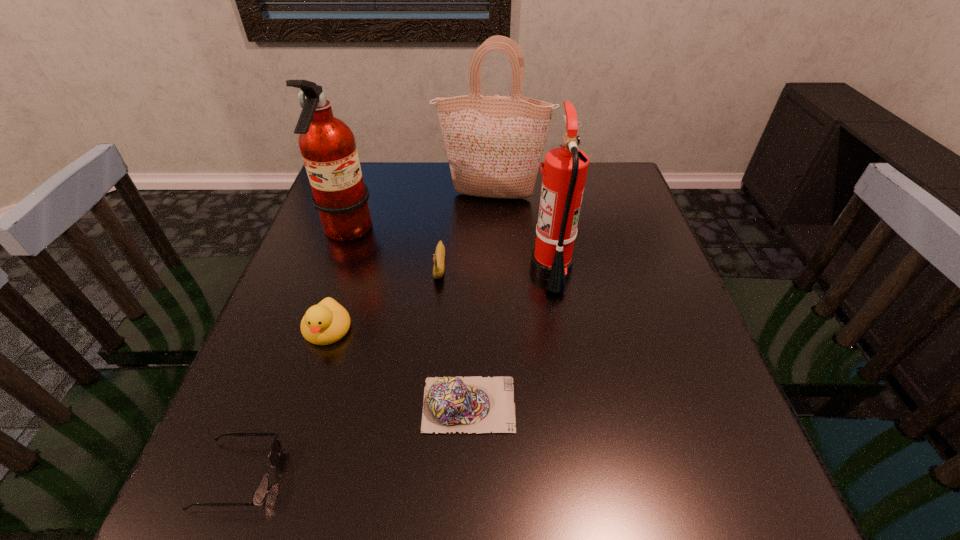
Where is `vacant area between the banana and the sixth farthest object`? This screenshot has height=540, width=960. vacant area between the banana and the sixth farthest object is located at coordinates (454, 335).

Image resolution: width=960 pixels, height=540 pixels. Identify the location of free space between the second shortest object and the nearest object. [353, 440].

Where is `unoccupied area between the duckling and the left fire extinguisher`? Image resolution: width=960 pixels, height=540 pixels. unoccupied area between the duckling and the left fire extinguisher is located at coordinates (337, 281).

I want to click on free space between the farthest object and the banana, so click(466, 231).

The image size is (960, 540). I want to click on unoccupied area between the banana and the right fire extinguisher, so click(x=495, y=267).

Identify the location of vacant space that's between the right fire extinguisher and the shortest object. (395, 372).

Image resolution: width=960 pixels, height=540 pixels. I want to click on vacant area between the nearest object and the duckling, so click(x=282, y=402).

Image resolution: width=960 pixels, height=540 pixels. In order to click on empty space that is in between the fifth farthest object and the cap in this screenshot , I will do [398, 367].

Locate an element on the screen. object that is the second nearest to the sixth farthest object is located at coordinates (565, 168).

Choose which object is the third nearest neighbor to the second nearest object. Please provide its 2D coordinates. Your answer should be formatted as a tuple, i.e. [(x, y)], where the tuple contains the x and y coordinates of a point satisfying the conditions above.

[(262, 489)]